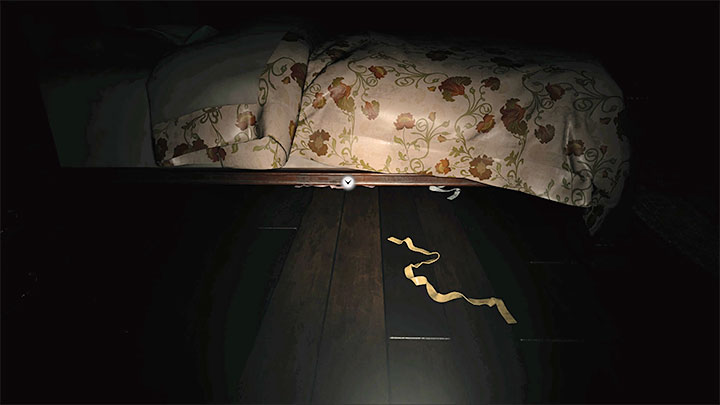
Image resolution: width=720 pixels, height=405 pixels. Identify the location of foot of bed. (602, 75).